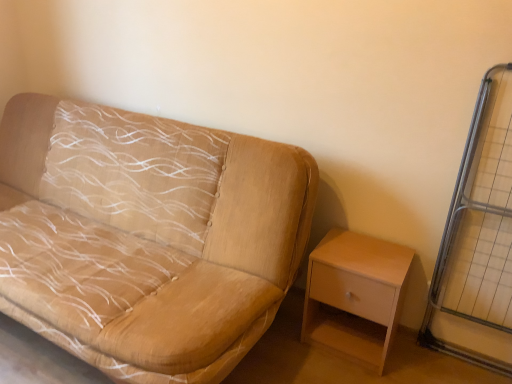
Where is `metal grid at right`? metal grid at right is located at coordinates (479, 228).

The height and width of the screenshot is (384, 512). I want to click on beige fabric couch at left, so click(x=146, y=236).

The width and height of the screenshot is (512, 384). Find the location of `light wood/wooden nightstand at lower right`. light wood/wooden nightstand at lower right is located at coordinates (355, 295).

Can you confirm if metal grid at right is bigger than beige fabric couch at left?

Incorrect, metal grid at right is not larger than beige fabric couch at left.

Is metal grid at right in front of or behind beige fabric couch at left in the image?

metal grid at right is behind beige fabric couch at left.

How different are the orientations of metal grid at right and beige fabric couch at left in degrees?

0.78 degrees.

Which object is positioned more to the left, metal grid at right or beige fabric couch at left?

beige fabric couch at left is more to the left.

From the image's perspective, is beige fabric couch at left under metal grid at right?

No, from the image's perspective, beige fabric couch at left is not below metal grid at right.

Which is in front, point (202, 380) or point (492, 224)?

Positioned in front is point (202, 380).

Considering the relative positions of beige fabric couch at left and metal grid at right in the image provided, is beige fabric couch at left behind metal grid at right?

That is False.

Considering the sizes of objects light wood/wooden nightstand at lower right and metal grid at right in the image provided, who is bigger, light wood/wooden nightstand at lower right or metal grid at right?

With larger size is light wood/wooden nightstand at lower right.

From a real-world perspective, which object rests below the other?

light wood/wooden nightstand at lower right is physically lower.

Between point (364, 249) and point (507, 255), which one is positioned in front?

Positioned in front is point (507, 255).

How distant is light wood/wooden nightstand at lower right from metal grid at right?

light wood/wooden nightstand at lower right is 15.09 inches from metal grid at right.

Is beige fabric couch at left facing towards light wood/wooden nightstand at lower right?

No, beige fabric couch at left is not oriented towards light wood/wooden nightstand at lower right.

Is beige fabric couch at left closer to camera compared to light wood/wooden nightstand at lower right?

That is True.

This screenshot has height=384, width=512. In order to click on nightstand located on the right of beige fabric couch at left in this screenshot , I will do `click(355, 295)`.

Considering the sizes of objects beige fabric couch at left and light wood/wooden nightstand at lower right in the image provided, who is smaller, beige fabric couch at left or light wood/wooden nightstand at lower right?

Smaller between the two is light wood/wooden nightstand at lower right.

Can you confirm if light wood/wooden nightstand at lower right is wider than beige fabric couch at left?

Incorrect, the width of light wood/wooden nightstand at lower right does not surpass that of beige fabric couch at left.

Between light wood/wooden nightstand at lower right and beige fabric couch at left, which one has larger size?

beige fabric couch at left is bigger.

Can you tell me how much light wood/wooden nightstand at lower right and beige fabric couch at left differ in facing direction?

0.74 degrees separate the facing orientations of light wood/wooden nightstand at lower right and beige fabric couch at left.

Is light wood/wooden nightstand at lower right facing towards beige fabric couch at left?

No, light wood/wooden nightstand at lower right is not facing towards beige fabric couch at left.

From a real-world perspective, who is located lower, metal grid at right or light wood/wooden nightstand at lower right?

light wood/wooden nightstand at lower right, from a real-world perspective.

Is metal grid at right in front of or behind light wood/wooden nightstand at lower right in the image?

Clearly, metal grid at right is in front of light wood/wooden nightstand at lower right.

Can you confirm if metal grid at right is taller than light wood/wooden nightstand at lower right?

Correct, metal grid at right is much taller as light wood/wooden nightstand at lower right.

From the image's perspective, is metal grid at right located above or below light wood/wooden nightstand at lower right?

metal grid at right is above light wood/wooden nightstand at lower right.

Find the location of `studio couch in front of the metal grid at right`. studio couch in front of the metal grid at right is located at coordinates (146, 236).

Where is `glass door that is above the beige fabric couch at left (from a real-world perspective)`? glass door that is above the beige fabric couch at left (from a real-world perspective) is located at coordinates 479,228.

Based on their spatial positions, is beige fabric couch at left or metal grid at right closer to light wood/wooden nightstand at lower right?

Among the two, metal grid at right is located nearer to light wood/wooden nightstand at lower right.

Which object lies nearer to the anchor point beige fabric couch at left, metal grid at right or light wood/wooden nightstand at lower right?

Based on the image, light wood/wooden nightstand at lower right appears to be nearer to beige fabric couch at left.

Estimate the real-world distances between objects in this image. Which object is further from beige fabric couch at left, light wood/wooden nightstand at lower right or metal grid at right?

metal grid at right is positioned further to the anchor beige fabric couch at left.

Which object lies nearer to the anchor point metal grid at right, light wood/wooden nightstand at lower right or beige fabric couch at left?

light wood/wooden nightstand at lower right lies closer to metal grid at right than the other object.

Considering their positions, is beige fabric couch at left positioned further to metal grid at right than light wood/wooden nightstand at lower right?

Based on the image, beige fabric couch at left appears to be further to metal grid at right.

From the image, which object appears to be nearer to light wood/wooden nightstand at lower right, metal grid at right or beige fabric couch at left?

metal grid at right is closer to light wood/wooden nightstand at lower right.

I want to click on nightstand between beige fabric couch at left and metal grid at right, so click(355, 295).